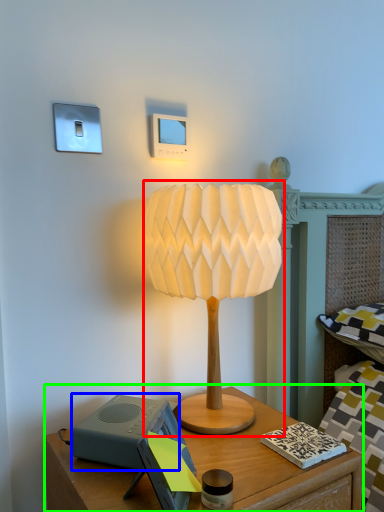
Question: Which object is positioned closest to lamp (highlighted by a red box)? Select from speaker (highlighted by a blue box) and nightstand (highlighted by a green box).

Choices:
 (A) speaker
 (B) nightstand

Answer: (A)